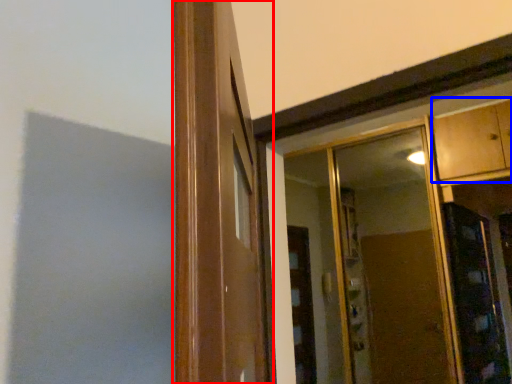
Question: Which object is closer to the camera taking this photo, window frame (highlighted by a red box) or cabinetry (highlighted by a blue box)?

Choices:
 (A) window frame
 (B) cabinetry

Answer: (A)